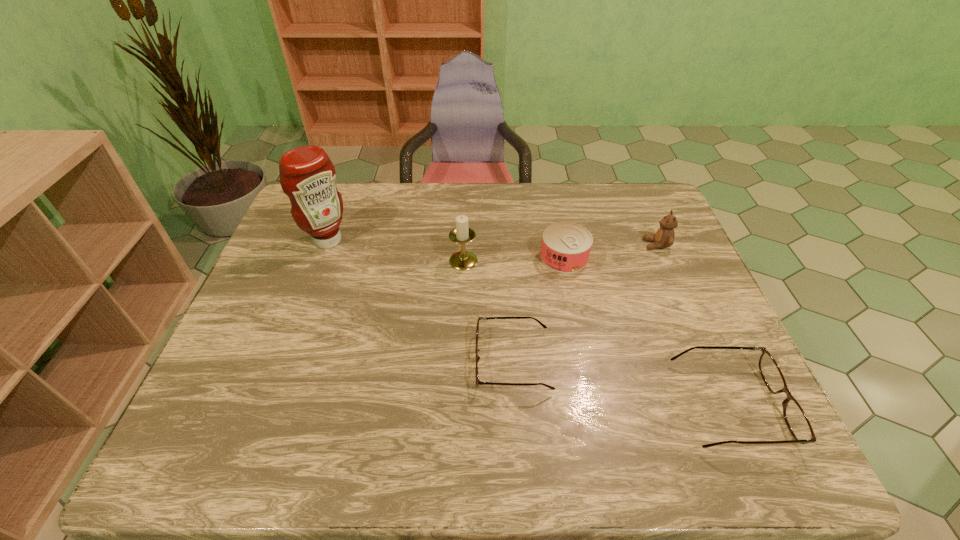
This screenshot has width=960, height=540. I want to click on spectacles present at the right edge, so click(796, 419).

Locate an element on the screen. Image resolution: width=960 pixels, height=540 pixels. teddy bear present at the right edge is located at coordinates (664, 237).

Image resolution: width=960 pixels, height=540 pixels. Find the location of `object present at the near right corner`. object present at the near right corner is located at coordinates (796, 419).

Image resolution: width=960 pixels, height=540 pixels. Identify the location of vacant space at the far edge. (532, 193).

The width and height of the screenshot is (960, 540). In the image, there is a desktop. Identify the location of vacant space at the near edge. (385, 384).

In order to click on vacant space at the left edge of the desktop in this screenshot , I will do `click(290, 306)`.

Locate an element on the screen. vacant region at the right edge of the desktop is located at coordinates (709, 300).

This screenshot has height=540, width=960. What are the coordinates of `free space between the shortest object and the candle holder` in the screenshot? It's located at coord(489,310).

Image resolution: width=960 pixels, height=540 pixels. What are the coordinates of `empty location between the can and the right spectacles` in the screenshot? It's located at (647, 331).

You are a GUI agent. You are given a task and a screenshot of the screen. Output one action in this format:
    pyautogui.click(x=<x>, y=<y>)
    Task: Click on the free space between the condiment and the second tallest object
    
    Given the screenshot: What is the action you would take?
    pyautogui.click(x=396, y=251)